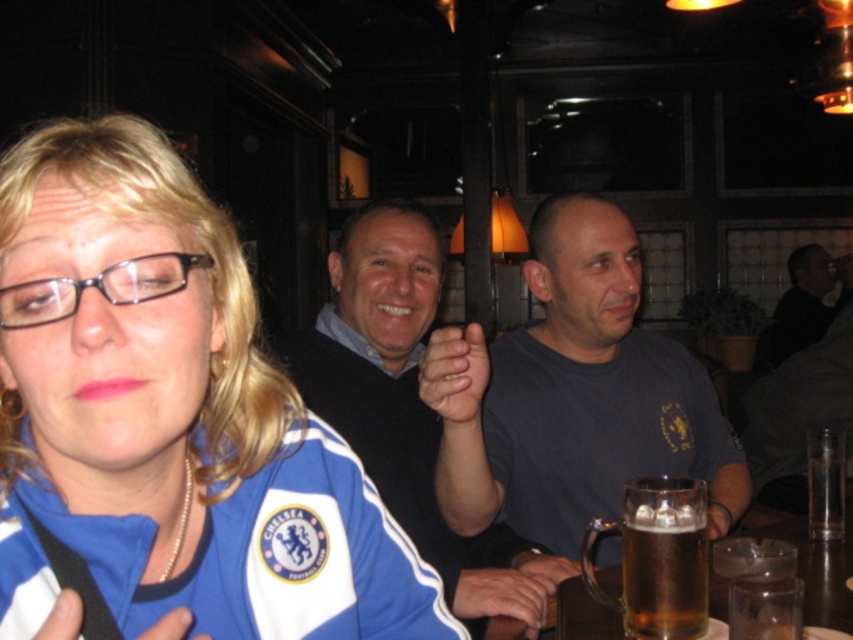
Is black sweater at center above dark gray shirt at upper right?

Incorrect, black sweater at center is not positioned above dark gray shirt at upper right.

Does black sweater at center have a greater width compared to dark gray shirt at upper right?

No, black sweater at center is not wider than dark gray shirt at upper right.

Does point (486, 563) come in front of point (822, 268)?

Yes, it is.

This screenshot has width=853, height=640. Identify the location of black sweater at center. (405, 406).

Which is more to the left, dark gray t-shirt at center or translucent glass mug at lower center?

Positioned to the left is dark gray t-shirt at center.

Who is more forward, (457, 500) or (804, 554)?

Point (457, 500)

Locate an element on the screen. The width and height of the screenshot is (853, 640). dark gray t-shirt at center is located at coordinates (573, 396).

Which is above, dark gray t-shirt at center or black sweater at center?

dark gray t-shirt at center

Can you confirm if dark gray t-shirt at center is positioned above black sweater at center?

Indeed, dark gray t-shirt at center is positioned over black sweater at center.

What do you see at coordinates (573, 396) in the screenshot? I see `dark gray t-shirt at center` at bounding box center [573, 396].

Where is `dark gray t-shirt at center`? dark gray t-shirt at center is located at coordinates (573, 396).